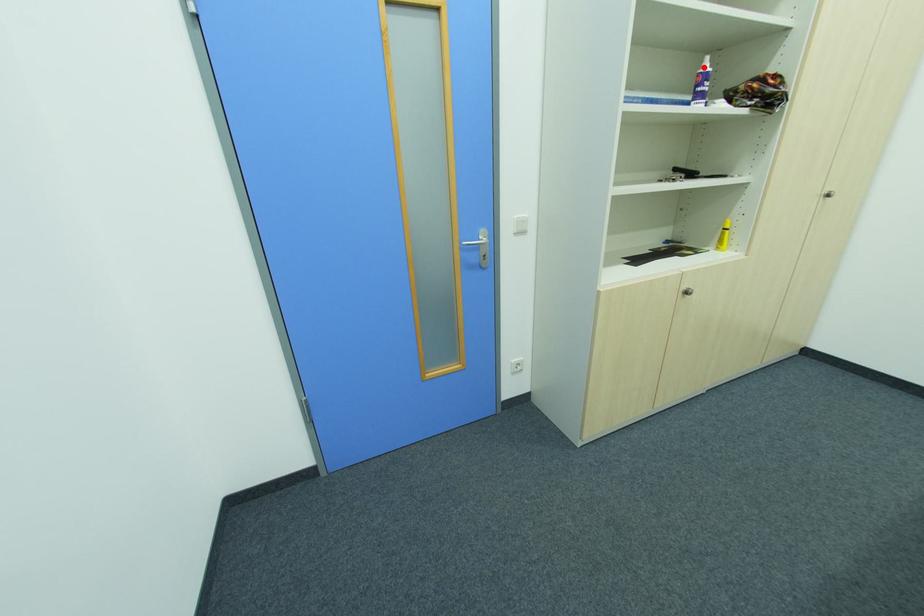
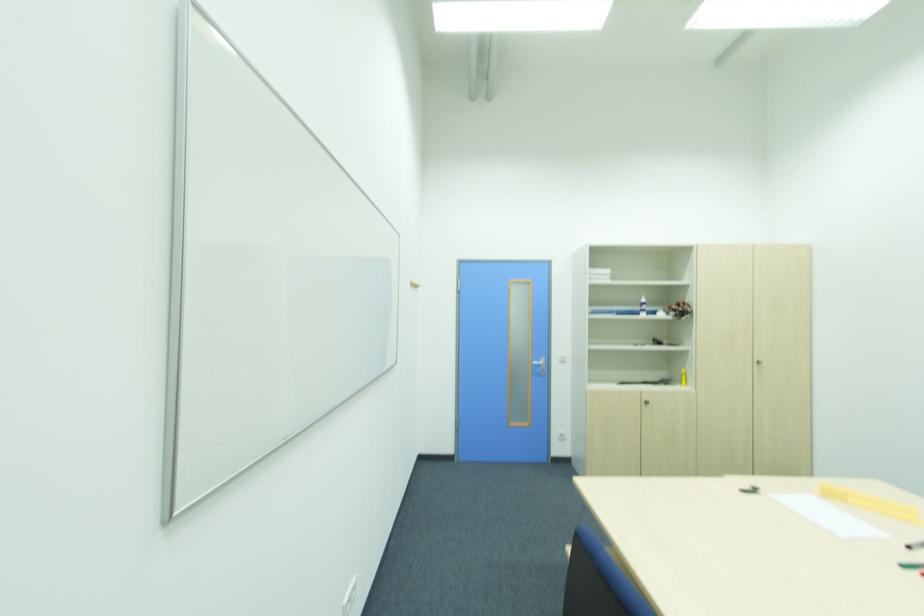
Question: A red point is marked in image1. In image2, is the corresponding 3D point closer to the camera or farther? Reply with the corresponding letter.

Choices:
 (A) The corresponding 3D point is closer.
 (B) The corresponding 3D point is farther.

Answer: (A)